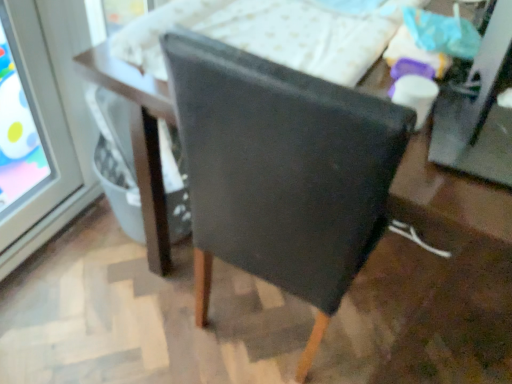
I want to click on free space to the left of matte black chair at center, so click(x=109, y=319).